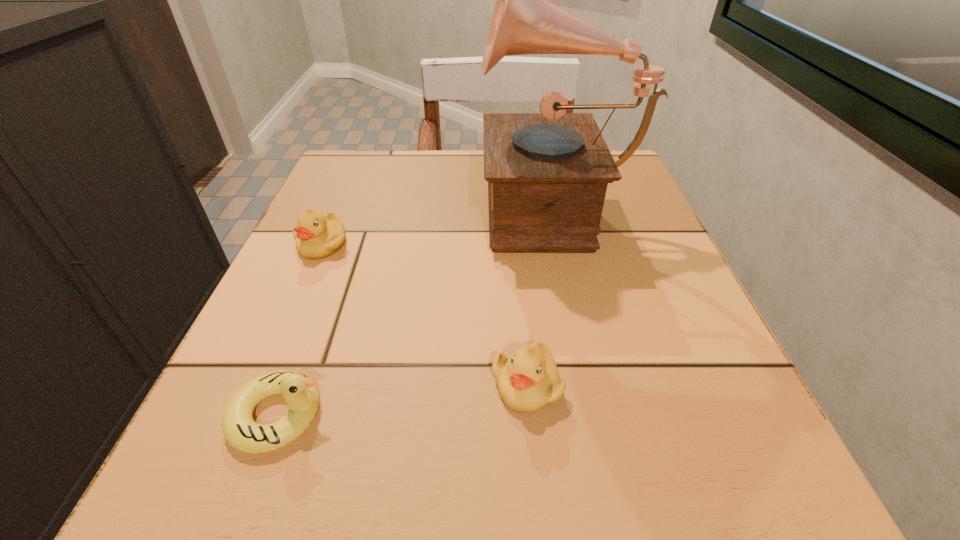
Identify the location of empty space between the rightmost duckling and the tallest object. (540, 295).

This screenshot has height=540, width=960. What are the coordinates of `vacant region between the record player and the farthest duckling` in the screenshot? It's located at (438, 225).

At what (x,y) coordinates should I click in order to perform the action: click on free point between the tallest object and the rightmost duckling. Please return your answer as a coordinate pair (x, y). The height and width of the screenshot is (540, 960). Looking at the image, I should click on (540, 295).

This screenshot has height=540, width=960. Find the location of `free space between the record player and the rightmost duckling`. free space between the record player and the rightmost duckling is located at coordinates click(x=540, y=295).

I want to click on free space between the rightmost duckling and the record player, so click(540, 295).

Where is `free space between the farthest duckling and the rightmost duckling`? Image resolution: width=960 pixels, height=540 pixels. free space between the farthest duckling and the rightmost duckling is located at coordinates (424, 314).

Identify which object is the second closest to the rightmost duckling. Please provide its 2D coordinates. Your answer should be formatted as a tuple, i.e. [(x, y)], where the tuple contains the x and y coordinates of a point satisfying the conditions above.

[(547, 173)]

Find the location of `object that is the closest to the rightmost duckling`. object that is the closest to the rightmost duckling is located at coordinates (300, 393).

Locate an element on the screen. This screenshot has height=540, width=960. duckling that stands as the closest to the farthest duckling is located at coordinates (300, 393).

Where is `duckling that is the second closest to the farthest duckling`? Image resolution: width=960 pixels, height=540 pixels. duckling that is the second closest to the farthest duckling is located at coordinates (528, 380).